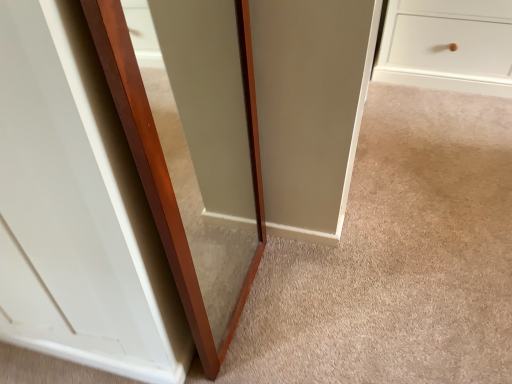
Question: Which direction should I rotate to face transparent glass door at center, placed as the second glass door when sorted from right to left, — up or down?

Choices:
 (A) down
 (B) up

Answer: (B)

Question: Which direction should I rotate to look at transparent glass door at center, which is the second glass door from left to right, — up or down?

Choices:
 (A) up
 (B) down

Answer: (A)

Question: Is transparent glass door at center, placed as the second glass door when sorted from right to left, touching transparent glass door at center, the first glass door viewed from the right?

Choices:
 (A) no
 (B) yes

Answer: (A)

Question: Is transparent glass door at center, the 1th glass door positioned from the left, behind transparent glass door at center, which is the second glass door from left to right?

Choices:
 (A) no
 (B) yes

Answer: (A)

Question: Considering the relative sizes of transparent glass door at center, placed as the second glass door when sorted from right to left, and transparent glass door at center, the first glass door viewed from the right, in the image provided, is transparent glass door at center, placed as the second glass door when sorted from right to left, smaller than transparent glass door at center, the first glass door viewed from the right,?

Choices:
 (A) yes
 (B) no

Answer: (B)

Question: Considering the relative sizes of transparent glass door at center, placed as the second glass door when sorted from right to left, and transparent glass door at center, the first glass door viewed from the right, in the image provided, is transparent glass door at center, placed as the second glass door when sorted from right to left, taller than transparent glass door at center, the first glass door viewed from the right,?

Choices:
 (A) yes
 (B) no

Answer: (A)

Question: Is transparent glass door at center, placed as the second glass door when sorted from right to left, oriented away from transparent glass door at center, which is the second glass door from left to right?

Choices:
 (A) no
 (B) yes

Answer: (A)

Question: From the image's perspective, is transparent glass door at center, placed as the second glass door when sorted from right to left, above transparent glass door at center, the first glass door viewed from the right?

Choices:
 (A) no
 (B) yes

Answer: (B)

Question: From a real-world perspective, is transparent glass door at center, the first glass door viewed from the right, beneath transparent glass door at center, placed as the second glass door when sorted from right to left?

Choices:
 (A) yes
 (B) no

Answer: (A)

Question: Can you confirm if transparent glass door at center, which is the second glass door from left to right, is bigger than transparent glass door at center, placed as the second glass door when sorted from right to left?

Choices:
 (A) yes
 (B) no

Answer: (B)

Question: Is transparent glass door at center, which is the second glass door from left to right, further to the viewer compared to transparent glass door at center, the 1th glass door positioned from the left?

Choices:
 (A) yes
 (B) no

Answer: (A)

Question: Is transparent glass door at center, which is the second glass door from left to right, to the right of transparent glass door at center, placed as the second glass door when sorted from right to left, from the viewer's perspective?

Choices:
 (A) yes
 (B) no

Answer: (A)

Question: Is transparent glass door at center, which is the second glass door from left to right, thinner than transparent glass door at center, placed as the second glass door when sorted from right to left?

Choices:
 (A) no
 (B) yes

Answer: (B)

Question: Is transparent glass door at center, the first glass door viewed from the right, facing away from transparent glass door at center, the 1th glass door positioned from the left?

Choices:
 (A) no
 (B) yes

Answer: (B)

Question: Considering their positions, is transparent glass door at center, placed as the second glass door when sorted from right to left, located in front of or behind transparent glass door at center, the first glass door viewed from the right?

Choices:
 (A) front
 (B) behind

Answer: (A)